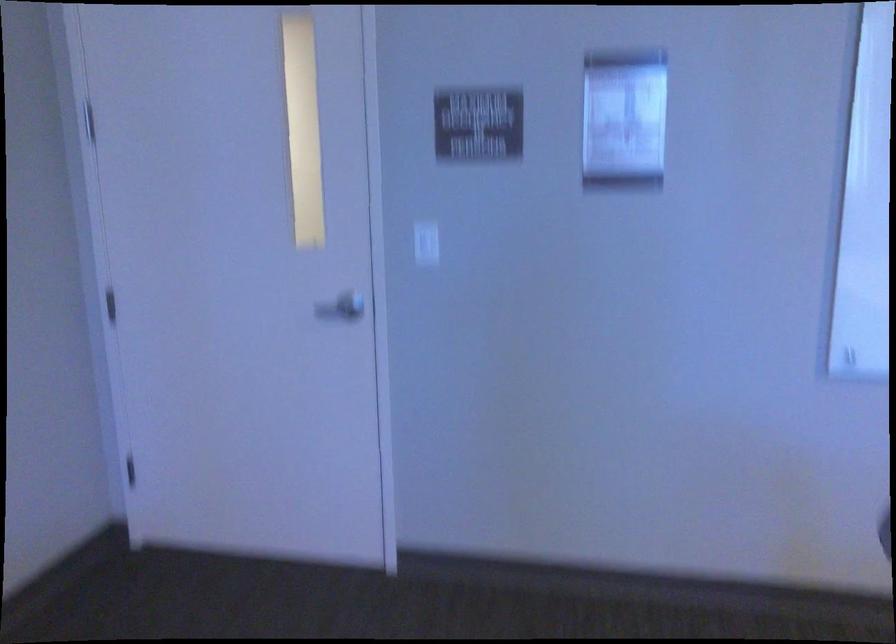
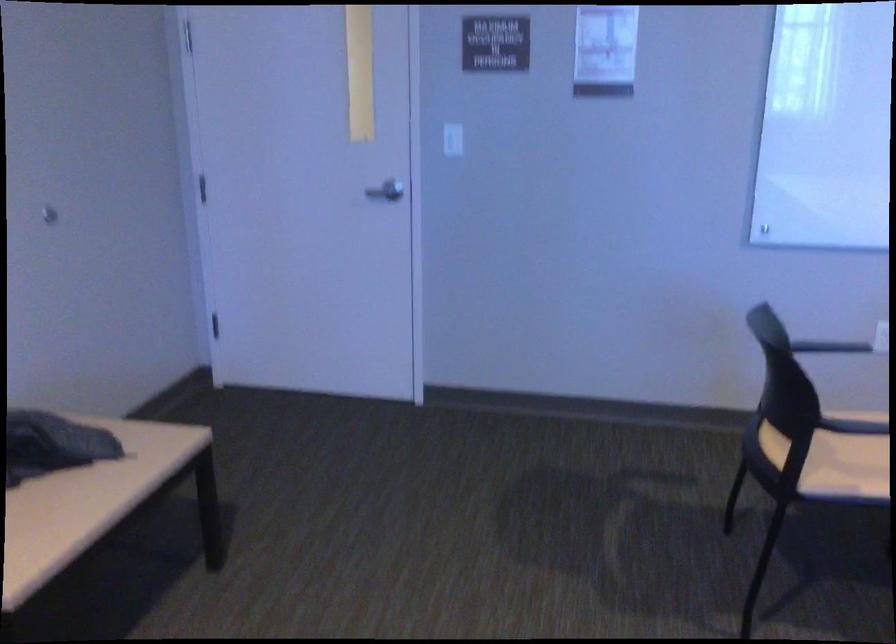
Question: Based on the continuous images, in which direction is the camera rotating? Reply with the corresponding letter.

Choices:
 (A) Left
 (B) Right
 (C) Up
 (D) Down

Answer: (D)